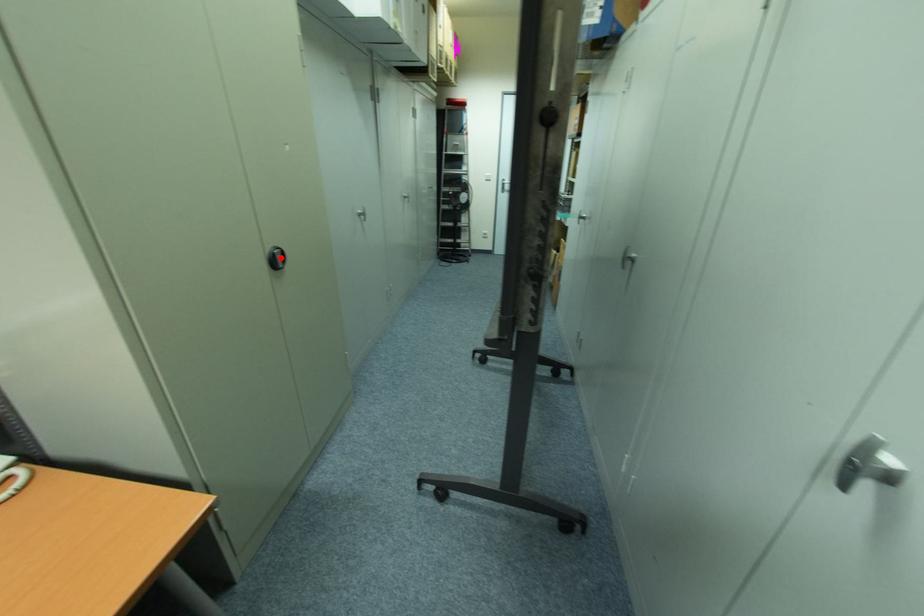
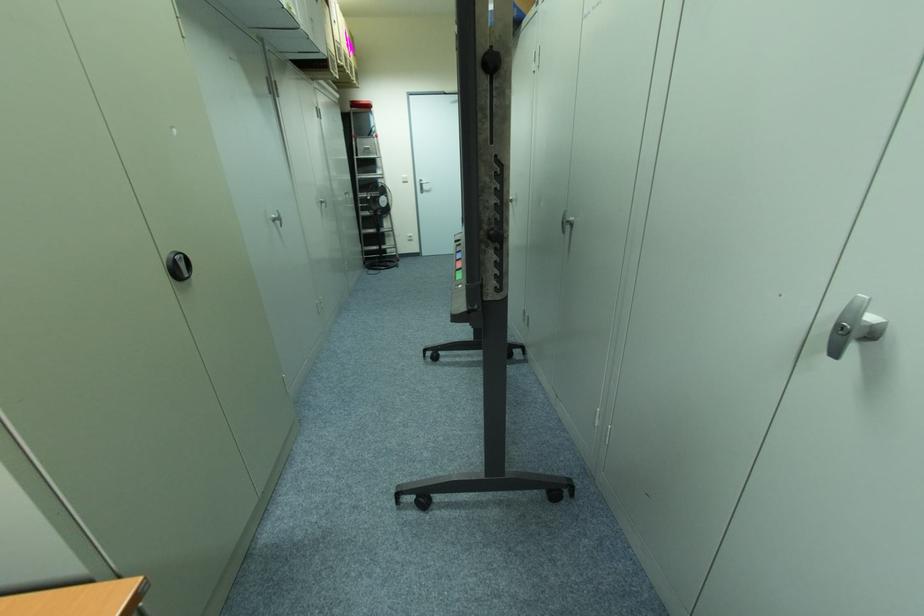
The point at the highlighted location is marked in the first image. Where is the corresponding point in the second image?

(181, 265)